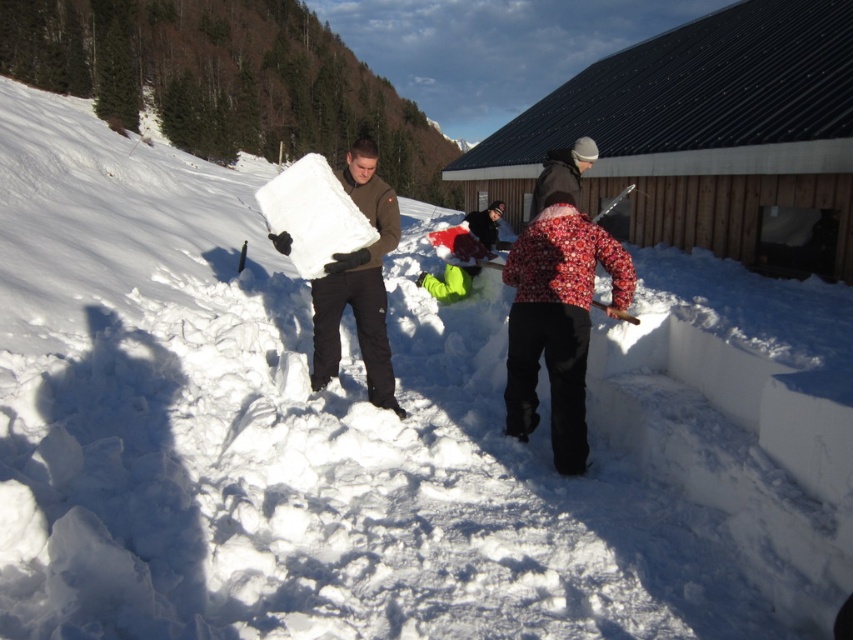
Is point (370, 381) behind point (560, 173)?

No, (370, 381) is in front of (560, 173).

Can you confirm if white matte ice at center is positioned below dark brown woolen hat at upper center?

Correct, white matte ice at center is located below dark brown woolen hat at upper center.

Is point (381, 355) positioned before point (541, 182)?

Yes.

Locate an element on the screen. white matte ice at center is located at coordinates (358, 284).

Does floral-patterned jacket at center appear on the right side of dark brown woolen hat at upper center?

In fact, floral-patterned jacket at center is to the left of dark brown woolen hat at upper center.

Between floral-patterned jacket at center and dark brown woolen hat at upper center, which one has less height?

With less height is dark brown woolen hat at upper center.

Where is `floral-patterned jacket at center`? This screenshot has width=853, height=640. floral-patterned jacket at center is located at coordinates (556, 321).

Which is more to the right, floral-patterned jacket at center or white matte ice at center?

From the viewer's perspective, floral-patterned jacket at center appears more on the right side.

Which is behind, point (566, 237) or point (357, 288)?

The point (357, 288) is behind.

Who is more forward, [550,396] or [364,342]?

Point [550,396] is in front.

Locate an element on the screen. floral-patterned jacket at center is located at coordinates (556, 321).